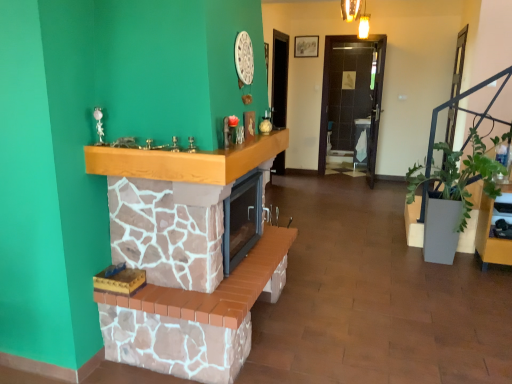
The image size is (512, 384). In order to click on stone fireplace at center in this screenshot , I will do `click(185, 258)`.

Image resolution: width=512 pixels, height=384 pixels. What do you see at coordinates (185, 258) in the screenshot?
I see `stone fireplace at center` at bounding box center [185, 258].

What is the approximate height of stone fireplace at center?

It is 32.91 inches.

Locate an element on the screen. This screenshot has height=384, width=512. stone fireplace at center is located at coordinates (185, 258).